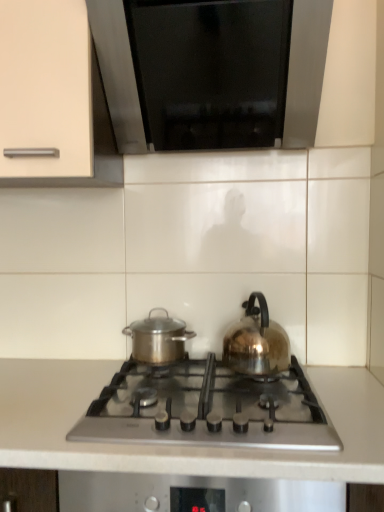
Question: From a real-world perspective, does white matte countertop at center stand above stainless steel pot at center?

Choices:
 (A) yes
 (B) no

Answer: (B)

Question: Is white matte countertop at center facing towards stainless steel pot at center?

Choices:
 (A) yes
 (B) no

Answer: (B)

Question: From the image's perspective, would you say white matte countertop at center is shown under stainless steel pot at center?

Choices:
 (A) yes
 (B) no

Answer: (A)

Question: Is there a large distance between white matte countertop at center and stainless steel pot at center?

Choices:
 (A) no
 (B) yes

Answer: (A)

Question: Does white matte countertop at center lie in front of stainless steel pot at center?

Choices:
 (A) yes
 (B) no

Answer: (A)

Question: From a real-world perspective, is white matte countertop at center located beneath stainless steel pot at center?

Choices:
 (A) yes
 (B) no

Answer: (A)

Question: Is satin silver gas stove at center positioned before black glass at upper center?

Choices:
 (A) no
 (B) yes

Answer: (B)

Question: From the image's perspective, is satin silver gas stove at center on black glass at upper center?

Choices:
 (A) no
 (B) yes

Answer: (A)

Question: Considering the relative sizes of satin silver gas stove at center and black glass at upper center in the image provided, is satin silver gas stove at center taller than black glass at upper center?

Choices:
 (A) no
 (B) yes

Answer: (A)

Question: Does satin silver gas stove at center have a lesser height compared to black glass at upper center?

Choices:
 (A) no
 (B) yes

Answer: (B)

Question: Is black glass at upper center inside satin silver gas stove at center?

Choices:
 (A) no
 (B) yes

Answer: (A)

Question: From the image's perspective, would you say satin silver gas stove at center is shown under black glass at upper center?

Choices:
 (A) yes
 (B) no

Answer: (A)

Question: Is white matte countertop at center to the right of satin silver gas stove at center from the viewer's perspective?

Choices:
 (A) no
 (B) yes

Answer: (A)